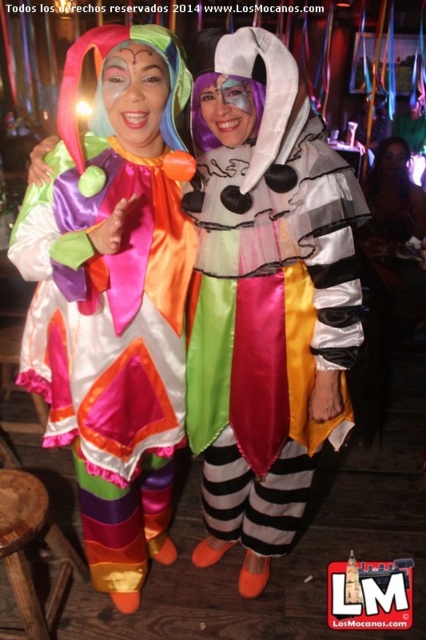
Who is higher up, satin/rich fabric costume at left or wooden stool at lower left?

satin/rich fabric costume at left

Does point (112, 408) lie behind point (58, 586)?

No, (112, 408) is closer to viewer.

The height and width of the screenshot is (640, 426). Describe the element at coordinates (111, 349) in the screenshot. I see `satin/rich fabric costume at left` at that location.

The width and height of the screenshot is (426, 640). I want to click on satin/rich fabric costume at left, so click(111, 349).